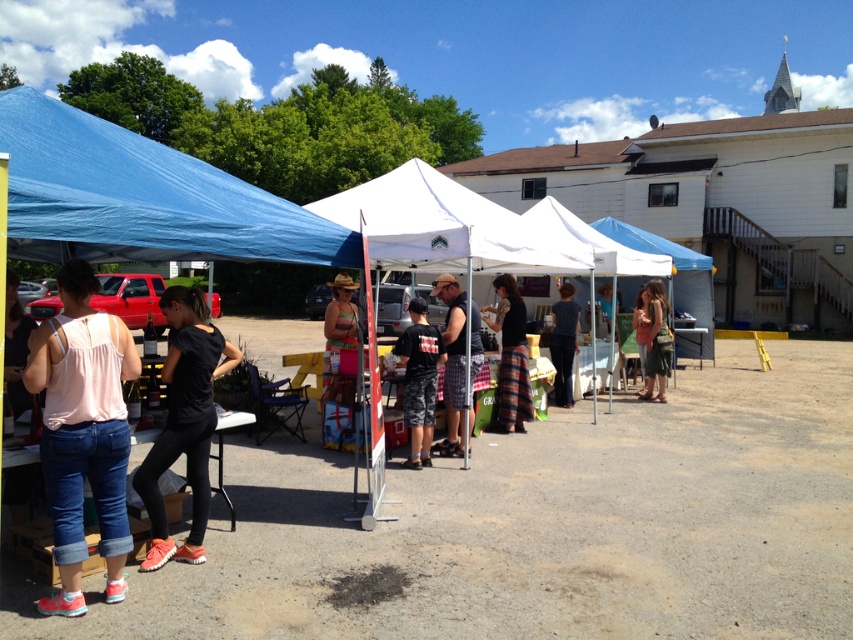
Does pink fabric tank top at left appear on the left side of black textured skirt at center?

Correct, you'll find pink fabric tank top at left to the left of black textured skirt at center.

At what (x,y) coordinates should I click in order to perform the action: click on pink fabric tank top at left. Please return your answer as a coordinate pair (x, y). This screenshot has width=853, height=640. Looking at the image, I should click on (83, 432).

Does point (440, 264) come closer to viewer compared to point (577, 323)?

Yes.

Measure the distance between white fabric tent at center and camera.

They are 5.52 meters apart.

Is point (439, 195) closer to viewer compared to point (567, 348)?

Yes, point (439, 195) is in front of point (567, 348).

At what (x,y) coordinates should I click in order to perform the action: click on white fabric tent at center. Please return your answer as a coordinate pair (x, y). Looking at the image, I should click on (451, 227).

Who is higher up, camouflage shorts at center or green fabric skirt at center?

Positioned higher is green fabric skirt at center.

Measure the distance between camouflage shorts at center and green fabric skirt at center.

camouflage shorts at center is 4.17 meters away from green fabric skirt at center.

Image resolution: width=853 pixels, height=640 pixels. Describe the element at coordinates (457, 358) in the screenshot. I see `camouflage shorts at center` at that location.

Locate an element on the screen. This screenshot has height=640, width=853. camouflage shorts at center is located at coordinates (457, 358).